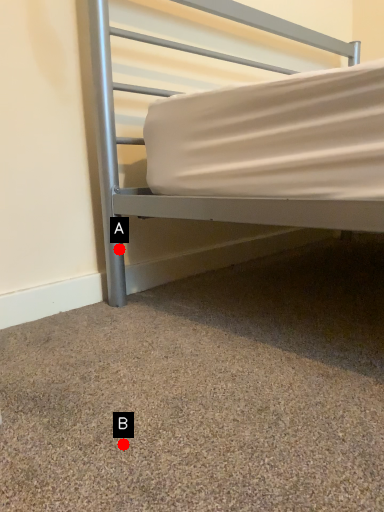
Question: Two points are circled on the image, labeled by A and B beside each circle. Which point appears farthest from the camera in this image?

Choices:
 (A) A is further
 (B) B is further

Answer: (A)